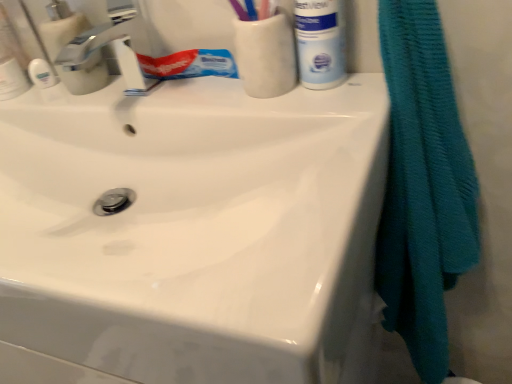
Describe the element at coordinates (320, 43) in the screenshot. The image size is (512, 384). I see `white matte mouthwash at upper right` at that location.

Measure the distance between point (337, 27) and camera.

Point (337, 27) is 20.98 inches away from camera.

What is the approximate height of white matte mouthwash at upper right?

7.12 inches.

At what (x,y) coordinates should I click in order to perform the action: click on white matte mouthwash at upper right. Please return your answer as a coordinate pair (x, y). Looking at the image, I should click on (320, 43).

In the scene shown: What is the approximate width of white matte mouthwash at upper right?

The width of white matte mouthwash at upper right is 2.43 inches.

Identify the location of teal textured towel at right. (423, 187).

The height and width of the screenshot is (384, 512). Describe the element at coordinates (423, 187) in the screenshot. I see `teal textured towel at right` at that location.

Find the location of `white matte mouthwash at upper right`. white matte mouthwash at upper right is located at coordinates (320, 43).

In the image, is teal textured towel at right on the left side or the right side of white matte mouthwash at upper right?

From the image, it's evident that teal textured towel at right is to the right of white matte mouthwash at upper right.

Based on the photo, which object is further away from the camera taking this photo, teal textured towel at right or white matte mouthwash at upper right?

white matte mouthwash at upper right.

Considering the points (472, 251) and (329, 35), which point is behind, point (472, 251) or point (329, 35)?

Point (472, 251)

From the image's perspective, relative to white matte mouthwash at upper right, is teal textured towel at right above or below?

From the image's perspective, teal textured towel at right appears below white matte mouthwash at upper right.

From a real-world perspective, relative to white matte mouthwash at upper right, is teal textured towel at right vertically above or below?

Clearly, from a real-world perspective, teal textured towel at right is below white matte mouthwash at upper right.

Looking at their sizes, would you say teal textured towel at right is wider or thinner than white matte mouthwash at upper right?

teal textured towel at right is wider than white matte mouthwash at upper right.

Which of these two, teal textured towel at right or white matte mouthwash at upper right, stands taller?

teal textured towel at right is taller.

Considering the sizes of teal textured towel at right and white matte mouthwash at upper right in the image, is teal textured towel at right bigger or smaller than white matte mouthwash at upper right?

teal textured towel at right is bigger than white matte mouthwash at upper right.

Is white matte mouthwash at upper right completely or partially inside teal textured towel at right?

No, white matte mouthwash at upper right is not surrounded by teal textured towel at right.

Consider the image. Is teal textured towel at right directly adjacent to white matte mouthwash at upper right?

No, teal textured towel at right is not next to white matte mouthwash at upper right.

Is teal textured towel at right looking in the opposite direction of white matte mouthwash at upper right?

That's not correct — teal textured towel at right is not looking away from white matte mouthwash at upper right.

Locate an element on the screen. bath towel lying in front of the white matte mouthwash at upper right is located at coordinates (423, 187).

Is white matte mouthwash at upper right at the left side of teal textured towel at right?

Correct, you'll find white matte mouthwash at upper right to the left of teal textured towel at right.

Which object is further away from the camera, white matte mouthwash at upper right or teal textured towel at right?

white matte mouthwash at upper right is further from the camera.

Which point is more distant from viewer, (329, 68) or (443, 171)?

The point (329, 68) is farther from the camera.

From the image's perspective, between white matte mouthwash at upper right and teal textured towel at right, which one is located above?

From the image's view, white matte mouthwash at upper right is above.

From a real-world perspective, is white matte mouthwash at upper right physically located above or below teal textured towel at right?

white matte mouthwash at upper right is above teal textured towel at right.

Does white matte mouthwash at upper right have a greater width compared to teal textured towel at right?

In fact, white matte mouthwash at upper right might be narrower than teal textured towel at right.

In terms of height, does white matte mouthwash at upper right look taller or shorter compared to teal textured towel at right?

white matte mouthwash at upper right is shorter than teal textured towel at right.

Considering the sizes of white matte mouthwash at upper right and teal textured towel at right in the image, is white matte mouthwash at upper right bigger or smaller than teal textured towel at right?

Considering their sizes, white matte mouthwash at upper right takes up less space than teal textured towel at right.

Do you think white matte mouthwash at upper right is within teal textured towel at right, or outside of it?

white matte mouthwash at upper right exists outside the volume of teal textured towel at right.

Is white matte mouthwash at upper right in contact with teal textured towel at right?

white matte mouthwash at upper right is not next to teal textured towel at right, and they're not touching.

Is white matte mouthwash at upper right oriented away from teal textured towel at right?

No.

Can you tell me how much white matte mouthwash at upper right and teal textured towel at right differ in facing direction?

The facing directions of white matte mouthwash at upper right and teal textured towel at right are 3.92 degrees apart.

From the picture: Measure the distance from white matte mouthwash at upper right to teal textured towel at right.

They are 8.35 inches apart.

Locate an element on the screen. mouthwash on the left side of teal textured towel at right is located at coordinates (320, 43).

I want to click on mouthwash behind the teal textured towel at right, so click(320, 43).

The width and height of the screenshot is (512, 384). Find the location of `mouthwash that appears above the teal textured towel at right (from a real-world perspective)`. mouthwash that appears above the teal textured towel at right (from a real-world perspective) is located at coordinates (320, 43).